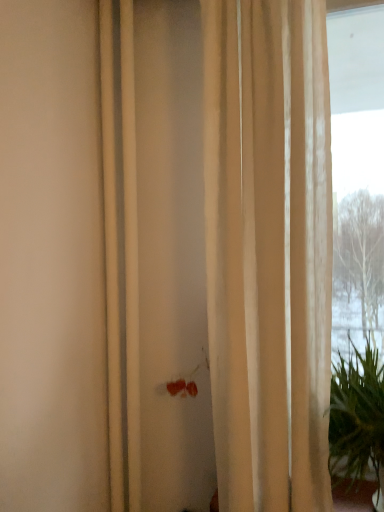
Question: Should I look upward or downward to see beige sheer curtain at center?

Choices:
 (A) down
 (B) up

Answer: (A)

Question: Is green leafy plant at right behind beige sheer curtain at center?

Choices:
 (A) no
 (B) yes

Answer: (A)

Question: From a real-world perspective, does green leafy plant at right stand above beige sheer curtain at center?

Choices:
 (A) yes
 (B) no

Answer: (B)

Question: Can we say green leafy plant at right lies outside beige sheer curtain at center?

Choices:
 (A) no
 (B) yes

Answer: (B)

Question: Could you tell me if green leafy plant at right is facing beige sheer curtain at center?

Choices:
 (A) yes
 (B) no

Answer: (B)

Question: Can you see green leafy plant at right touching beige sheer curtain at center?

Choices:
 (A) yes
 (B) no

Answer: (B)

Question: Considering the relative sizes of green leafy plant at right and beige sheer curtain at center in the image provided, is green leafy plant at right shorter than beige sheer curtain at center?

Choices:
 (A) no
 (B) yes

Answer: (B)

Question: From the image's perspective, is beige sheer curtain at center located above green leafy plant at right?

Choices:
 (A) yes
 (B) no

Answer: (A)

Question: Can you confirm if beige sheer curtain at center is positioned to the right of green leafy plant at right?

Choices:
 (A) no
 (B) yes

Answer: (A)

Question: Considering the relative positions of beige sheer curtain at center and green leafy plant at right in the image provided, is beige sheer curtain at center to the left of green leafy plant at right from the viewer's perspective?

Choices:
 (A) yes
 (B) no

Answer: (A)

Question: Can you confirm if beige sheer curtain at center is shorter than green leafy plant at right?

Choices:
 (A) no
 (B) yes

Answer: (A)

Question: From a real-world perspective, is beige sheer curtain at center physically below green leafy plant at right?

Choices:
 (A) no
 (B) yes

Answer: (A)

Question: Is beige sheer curtain at center further to camera compared to green leafy plant at right?

Choices:
 (A) no
 (B) yes

Answer: (B)

Question: Considering the relative positions of green leafy plant at right and beige sheer curtain at center in the image provided, is green leafy plant at right to the left or to the right of beige sheer curtain at center?

Choices:
 (A) right
 (B) left

Answer: (A)